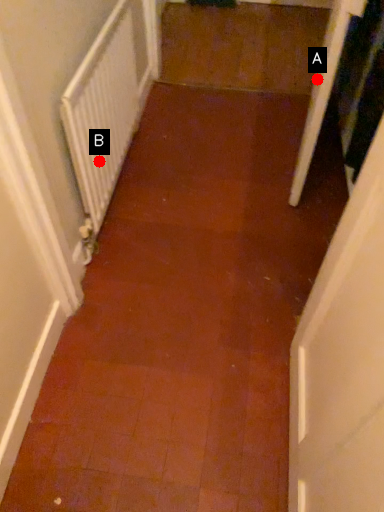
Question: Two points are circled on the image, labeled by A and B beside each circle. Which point is further to the camera?

Choices:
 (A) A is further
 (B) B is further

Answer: (B)